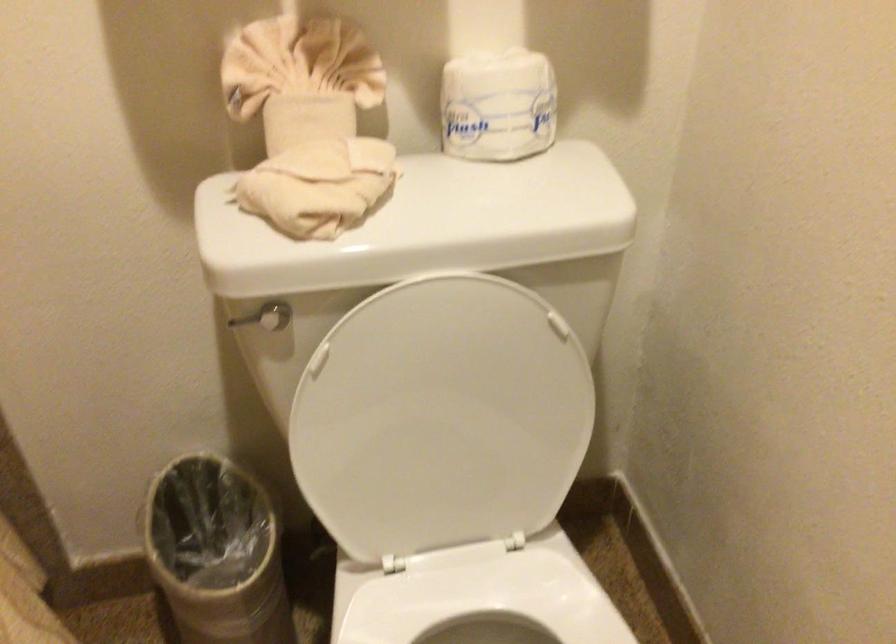
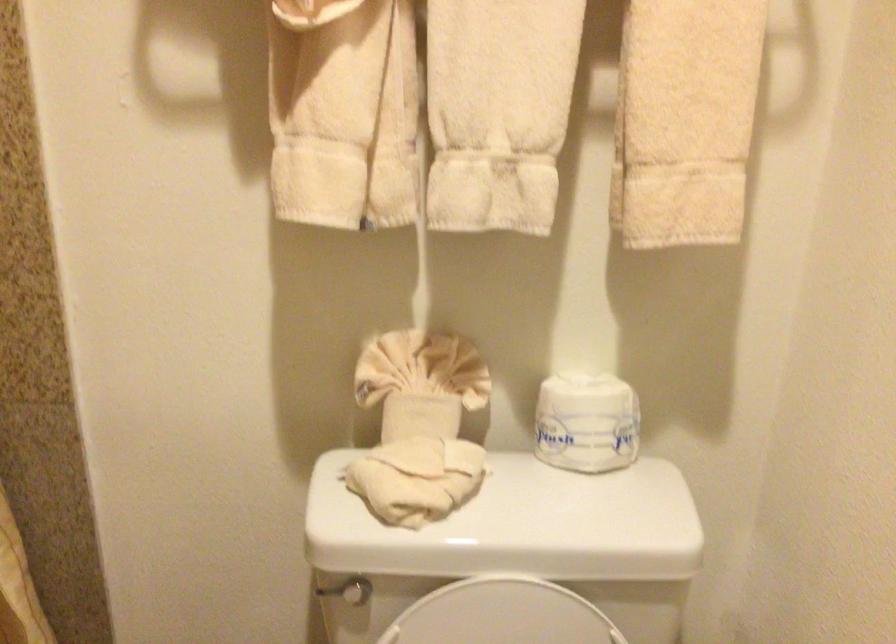
In the second image, find the point that corresponds to (238,319) in the first image.

(326, 590)